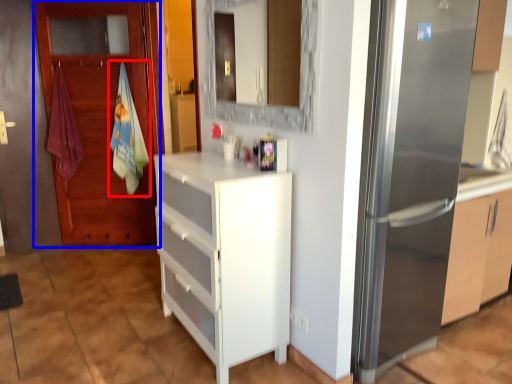
Question: Which object appears farthest to the camera in this image, beach towel (highlighted by a red box) or door (highlighted by a blue box)?

Choices:
 (A) beach towel
 (B) door

Answer: (A)